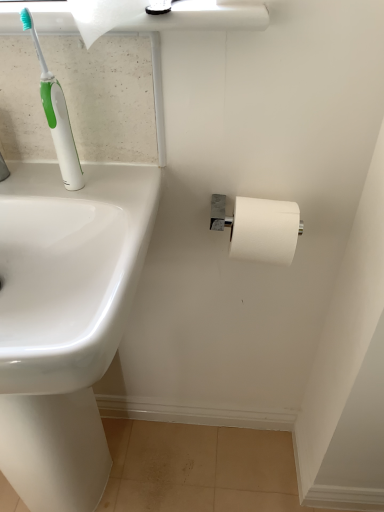
Where is `green plastic toothbrush at upper left`? green plastic toothbrush at upper left is located at coordinates (56, 116).

This screenshot has width=384, height=512. Describe the element at coordinates (56, 116) in the screenshot. I see `green plastic toothbrush at upper left` at that location.

What is the approximate height of white matte toilet paper at upper left, marked as the first toilet paper in a front-to-back arrangement?

The height of white matte toilet paper at upper left, marked as the first toilet paper in a front-to-back arrangement, is 5.88 inches.

The height and width of the screenshot is (512, 384). What do you see at coordinates (65, 320) in the screenshot?
I see `white glossy sink at left` at bounding box center [65, 320].

The height and width of the screenshot is (512, 384). Find the location of `white matte toilet paper at right, positioned as the second toilet paper in top-to-bottom order`. white matte toilet paper at right, positioned as the second toilet paper in top-to-bottom order is located at coordinates pyautogui.click(x=265, y=230).

Does point (61, 134) appear closer or farther from the camera than point (98, 362)?

Point (61, 134) appears to be farther away from the viewer than point (98, 362).

Does green plastic toothbrush at upper left have a lesser width compared to white glossy sink at left?

Yes, green plastic toothbrush at upper left is thinner than white glossy sink at left.

Where is `sink on the left of green plastic toothbrush at upper left`? This screenshot has height=512, width=384. sink on the left of green plastic toothbrush at upper left is located at coordinates (65, 320).

Is green plastic toothbrush at upper left not close to white glossy sink at left?

No, there isn't a large distance between green plastic toothbrush at upper left and white glossy sink at left.

From the picture: Is white matte toilet paper at upper left, which is the first toilet paper in left-to-right order, at the left side of white glossy sink at left?

No, white matte toilet paper at upper left, which is the first toilet paper in left-to-right order, is not to the left of white glossy sink at left.

Considering the points (108, 31) and (75, 389), which point is behind, point (108, 31) or point (75, 389)?

The point (108, 31) is behind.

Image resolution: width=384 pixels, height=512 pixels. I want to click on sink located underneath the white matte toilet paper at upper left, which ranks as the first toilet paper in top-to-bottom order (from a real-world perspective), so click(65, 320).

Is white matte toilet paper at upper left, arranged as the 2th toilet paper when viewed from the right, facing away from white glossy sink at left?

No, white glossy sink at left is not at the back of white matte toilet paper at upper left, arranged as the 2th toilet paper when viewed from the right.

Which point is more distant from viewer, (140, 20) or (242, 246)?

The point (242, 246) is farther from the camera.

From the image's perspective, does white matte toilet paper at upper left, which is the first toilet paper in left-to-right order, appear lower than white matte toilet paper at right, positioned as the second toilet paper in top-to-bottom order?

No, from the image's perspective, white matte toilet paper at upper left, which is the first toilet paper in left-to-right order, is not below white matte toilet paper at right, positioned as the second toilet paper in top-to-bottom order.

Relative to white matte toilet paper at right, positioned as the second toilet paper in top-to-bottom order, is white matte toilet paper at upper left, which is the first toilet paper in left-to-right order, in front or behind?

Visually, white matte toilet paper at upper left, which is the first toilet paper in left-to-right order, is located in front of white matte toilet paper at right, positioned as the second toilet paper in top-to-bottom order.

Is white matte toilet paper at upper left, marked as the first toilet paper in a front-to-back arrangement, shorter than white matte toilet paper at right, positioned as the second toilet paper in top-to-bottom order?

No.

Consider the image. Is white glossy sink at left outside of white matte toilet paper at upper left, arranged as the 2th toilet paper when viewed from the right?

That's correct, white glossy sink at left is outside of white matte toilet paper at upper left, arranged as the 2th toilet paper when viewed from the right.

Does white glossy sink at left touch white matte toilet paper at upper left, which ranks as the first toilet paper in top-to-bottom order?

white glossy sink at left is not next to white matte toilet paper at upper left, which ranks as the first toilet paper in top-to-bottom order, and they're not touching.

Based on the photo, how many degrees apart are the facing directions of white glossy sink at left and white matte toilet paper at upper left, arranged as the 2th toilet paper when viewed from the right?

The angle between the facing direction of white glossy sink at left and the facing direction of white matte toilet paper at upper left, arranged as the 2th toilet paper when viewed from the right, is 0.698 degrees.

Does white glossy sink at left come behind white matte toilet paper at upper left, marked as the first toilet paper in a front-to-back arrangement?

No, it is not.

Is white glossy sink at left directly adjacent to green plastic toothbrush at upper left?

No.

Is white glossy sink at left bigger or smaller than green plastic toothbrush at upper left?

Considering their sizes, white glossy sink at left takes up more space than green plastic toothbrush at upper left.

You are a GUI agent. You are given a task and a screenshot of the screen. Output one action in this format:
    pyautogui.click(x=<x>, y=<y>)
    Task: Click on the toilet brush above the white glossy sink at left (from a real-world perspective)
    This screenshot has height=512, width=384.
    Given the screenshot: What is the action you would take?
    pyautogui.click(x=56, y=116)

Consider the image. Which object is positioned more to the right, white glossy sink at left or green plastic toothbrush at upper left?

green plastic toothbrush at upper left.

Between white matte toilet paper at right, the 2th toilet paper positioned from the front, and white glossy sink at left, which one has less height?

Standing shorter between the two is white matte toilet paper at right, the 2th toilet paper positioned from the front.

Considering the relative positions of white matte toilet paper at right, positioned as the second toilet paper in top-to-bottom order, and white glossy sink at left in the image provided, is white matte toilet paper at right, positioned as the second toilet paper in top-to-bottom order, to the left or to the right of white glossy sink at left?

In the image, white matte toilet paper at right, positioned as the second toilet paper in top-to-bottom order, appears on the right side of white glossy sink at left.

Between white matte toilet paper at right, which is the 1th toilet paper in right-to-left order, and white glossy sink at left, which one has smaller size?

Smaller between the two is white matte toilet paper at right, which is the 1th toilet paper in right-to-left order.

Does white matte toilet paper at right, the 2th toilet paper positioned from the front, contain white glossy sink at left?

No.

Is white glossy sink at left surrounding white matte toilet paper at right, the 2th toilet paper when ordered from left to right?

No.

Between white glossy sink at left and white matte toilet paper at right, the 2th toilet paper positioned from the front, which one has smaller width?

white matte toilet paper at right, the 2th toilet paper positioned from the front.

Between white glossy sink at left and white matte toilet paper at right, the 2th toilet paper positioned from the front, which one has smaller size?

Smaller between the two is white matte toilet paper at right, the 2th toilet paper positioned from the front.

In the scene shown: Considering the sizes of objects white glossy sink at left and white matte toilet paper at right, the 2th toilet paper positioned from the front, in the image provided, who is taller, white glossy sink at left or white matte toilet paper at right, the 2th toilet paper positioned from the front,?

Standing taller between the two is white glossy sink at left.

Image resolution: width=384 pixels, height=512 pixels. I want to click on toilet brush above the white glossy sink at left (from a real-world perspective), so click(x=56, y=116).

What are the coordinates of `sink located underneath the white matte toilet paper at upper left, arranged as the 2th toilet paper when viewed from the right (from a real-world perspective)` in the screenshot? It's located at (65, 320).

Which object lies further to the anchor point white glossy sink at left, white matte toilet paper at right, the 2th toilet paper positioned from the front, or white matte toilet paper at upper left, arranged as the 2th toilet paper when viewed from the right?

Based on the image, white matte toilet paper at upper left, arranged as the 2th toilet paper when viewed from the right, appears to be further to white glossy sink at left.

When comparing their distances from green plastic toothbrush at upper left, does white matte toilet paper at upper left, the 2th toilet paper ordered from the bottom, or white glossy sink at left seem closer?

Based on the image, white matte toilet paper at upper left, the 2th toilet paper ordered from the bottom, appears to be nearer to green plastic toothbrush at upper left.

Considering their positions, is white matte toilet paper at right, which ranks as the 1th toilet paper in back-to-front order, positioned closer to white matte toilet paper at upper left, which is the first toilet paper in left-to-right order, than white glossy sink at left?

Among the two, white matte toilet paper at right, which ranks as the 1th toilet paper in back-to-front order, is located nearer to white matte toilet paper at upper left, which is the first toilet paper in left-to-right order.

From the image, which object appears to be farther from white matte toilet paper at right, positioned as the second toilet paper in top-to-bottom order, green plastic toothbrush at upper left or white glossy sink at left?

white glossy sink at left lies further to white matte toilet paper at right, positioned as the second toilet paper in top-to-bottom order, than the other object.

Which object lies further to the anchor point white glossy sink at left, white matte toilet paper at right, positioned as the second toilet paper in top-to-bottom order, or green plastic toothbrush at upper left?

Among the two, white matte toilet paper at right, positioned as the second toilet paper in top-to-bottom order, is located further to white glossy sink at left.

Based on their spatial positions, is white matte toilet paper at upper left, the 2th toilet paper from the back, or green plastic toothbrush at upper left closer to white glossy sink at left?

Among the two, green plastic toothbrush at upper left is located nearer to white glossy sink at left.

Based on their spatial positions, is white matte toilet paper at upper left, arranged as the 2th toilet paper when viewed from the right, or white glossy sink at left further from white matte toilet paper at right, which ranks as the 1th toilet paper in back-to-front order?

white glossy sink at left is positioned further to the anchor white matte toilet paper at right, which ranks as the 1th toilet paper in back-to-front order.

When comparing their distances from white glossy sink at left, does green plastic toothbrush at upper left or white matte toilet paper at right, which is the 1th toilet paper in right-to-left order, seem further?

Among the two, white matte toilet paper at right, which is the 1th toilet paper in right-to-left order, is located further to white glossy sink at left.

Find the location of a particular element. The image size is (384, 512). toilet paper between green plastic toothbrush at upper left and white matte toilet paper at right, the 2th toilet paper when ordered from left to right, in the horizontal direction is located at coordinates (105, 16).

Find the location of a particular element. toilet paper between white matte toilet paper at upper left, the 2th toilet paper ordered from the bottom, and white glossy sink at left, in the vertical direction is located at coordinates (265, 230).

What are the coordinates of `toilet paper between green plastic toothbrush at upper left and white glossy sink at left from top to bottom` in the screenshot? It's located at (265, 230).

Find the location of a particular element. This screenshot has height=512, width=384. toilet brush between white matte toilet paper at upper left, marked as the first toilet paper in a front-to-back arrangement, and white glossy sink at left in the up-down direction is located at coordinates (56, 116).